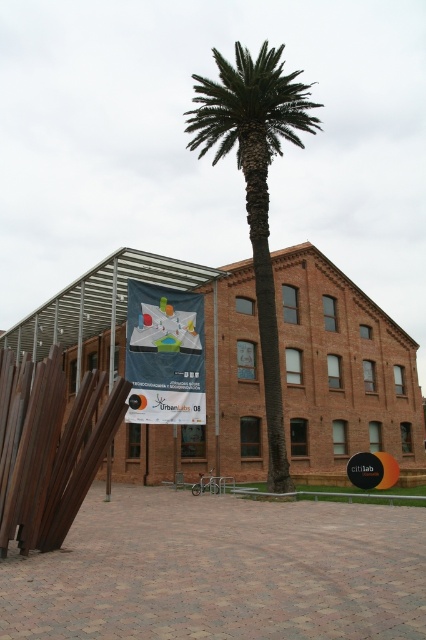
Question: Is brushed metal pole at left wider than smooth metal pole at center?

Choices:
 (A) yes
 (B) no

Answer: (A)

Question: Which object appears closest to the camera in this image?

Choices:
 (A) green leafy palm at center
 (B) brushed metal pole at left
 (C) smooth metal pole at center

Answer: (B)

Question: Which point appears farthest from the camera in this image?

Choices:
 (A) (213, 326)
 (B) (259, 276)
 (C) (115, 282)

Answer: (A)

Question: Does brushed metal pole at left have a lesser width compared to smooth metal pole at center?

Choices:
 (A) yes
 (B) no

Answer: (B)

Question: Does green leafy palm at center appear under brushed metal pole at left?

Choices:
 (A) yes
 (B) no

Answer: (B)

Question: Which point is farther from the camera taking this photo?

Choices:
 (A) click(x=216, y=452)
 (B) click(x=222, y=156)

Answer: (B)